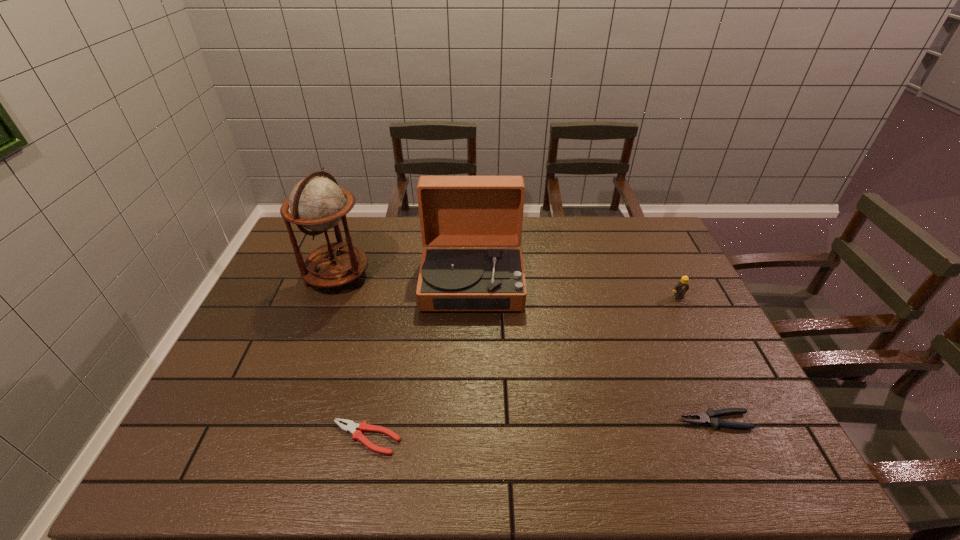
Where is `unoccupied position between the tallest object and the left pliers`? The image size is (960, 540). unoccupied position between the tallest object and the left pliers is located at coordinates (351, 357).

Image resolution: width=960 pixels, height=540 pixels. I want to click on free space between the shortest object and the Lego, so click(522, 367).

Where is `empty space that is in between the Lego and the shorter pliers`? empty space that is in between the Lego and the shorter pliers is located at coordinates (522, 367).

Find the location of `free point between the second shortest object and the third shortest object`. free point between the second shortest object and the third shortest object is located at coordinates (697, 359).

At what (x,y) coordinates should I click in order to perform the action: click on empty location between the fourth tallest object and the phonograph record. Please return your answer as a coordinate pair (x, y). Looking at the image, I should click on (593, 352).

The image size is (960, 540). I want to click on free space between the third tallest object and the second tallest object, so click(x=575, y=289).

Find the location of a particular element. vacant space in between the tallest object and the right pliers is located at coordinates (526, 348).

Where is `the closest object to the third tallest object`? the closest object to the third tallest object is located at coordinates (709, 417).

Identify which object is the second nearest to the left pliers. Please provide its 2D coordinates. Your answer should be formatted as a tuple, i.e. [(x, y)], where the tuple contains the x and y coordinates of a point satisfying the conditions above.

[(316, 203)]

Find the location of a particular element. The image size is (960, 540). free space that satisfies the following two spatial constraints: 1. on the surface of the left pliers; 2. on the right side of the globe is located at coordinates (277, 438).